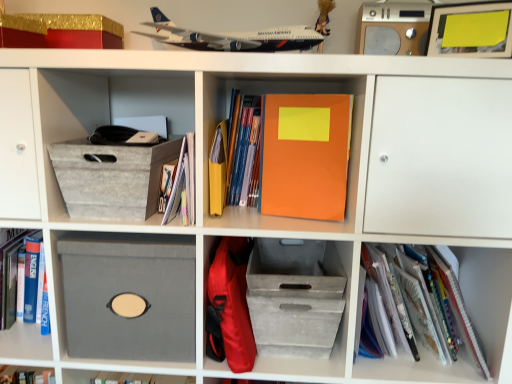
Question: Does matte yellow paper at center, the first paperback book from the left, have a lesser height compared to gold/red cardboard box at upper left?

Choices:
 (A) yes
 (B) no

Answer: (B)

Question: Is matte yellow paper at center, the 2th paperback book positioned from the right, thinner than gold/red cardboard box at upper left?

Choices:
 (A) no
 (B) yes

Answer: (B)

Question: Is gold/red cardboard box at upper left inside matte yellow paper at center, the first paperback book from the left?

Choices:
 (A) no
 (B) yes

Answer: (A)

Question: Is matte yellow paper at center, the first paperback book from the left, further to camera compared to gold/red cardboard box at upper left?

Choices:
 (A) yes
 (B) no

Answer: (B)

Question: Is matte yellow paper at center, the first paperback book from the left, far from gold/red cardboard box at upper left?

Choices:
 (A) no
 (B) yes

Answer: (A)

Question: From the image's perspective, would you say matte yellow paper at center, the 2th paperback book positioned from the right, is shown under gold/red cardboard box at upper left?

Choices:
 (A) yes
 (B) no

Answer: (A)

Question: Is matte blue book at center, which is counted as the second book, starting from the right, oriented towards white paper notebook at lower right, placed as the third book when sorted from left to right?

Choices:
 (A) yes
 (B) no

Answer: (B)

Question: Is matte blue book at center, which is counted as the second book, starting from the right, surrounding white paper notebook at lower right, placed as the third book when sorted from left to right?

Choices:
 (A) yes
 (B) no

Answer: (B)

Question: Can you confirm if matte blue book at center, which is counted as the second book, starting from the right, is wider than white paper notebook at lower right, placed as the third book when sorted from left to right?

Choices:
 (A) no
 (B) yes

Answer: (A)

Question: Is matte blue book at center, which is counted as the second book, starting from the right, not within white paper notebook at lower right, the first book positioned from the right?

Choices:
 (A) no
 (B) yes

Answer: (B)

Question: Is matte blue book at center, the second book when ordered from left to right, closer to camera compared to white paper notebook at lower right, the first book positioned from the right?

Choices:
 (A) yes
 (B) no

Answer: (B)

Question: From a real-world perspective, is matte blue book at center, the second book when ordered from left to right, over white paper notebook at lower right, placed as the third book when sorted from left to right?

Choices:
 (A) no
 (B) yes

Answer: (B)

Question: Is silver metallic speaker at upper right bigger than matte yellow paper at center, the 2th paperback book positioned from the right?

Choices:
 (A) yes
 (B) no

Answer: (A)